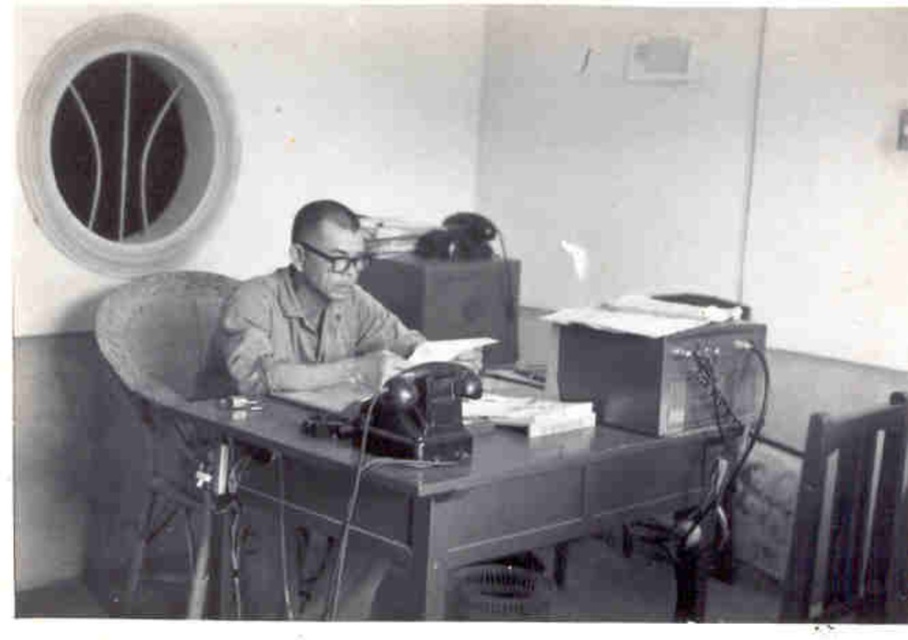
Question: Considering the real-world distances, which object is farthest from the metallic gray table at center?

Choices:
 (A) matte khaki shirt at center
 (B) metallic wireframe chair at lower right
 (C) wooden chair at left

Answer: (B)

Question: Does wooden chair at left appear on the right side of wooden chair at right?

Choices:
 (A) no
 (B) yes

Answer: (A)

Question: Is wooden chair at left positioned before matte khaki shirt at center?

Choices:
 (A) yes
 (B) no

Answer: (A)

Question: From the image, what is the correct spatial relationship of matte khaki shirt at center in relation to metallic wireframe chair at lower right?

Choices:
 (A) left
 (B) right

Answer: (A)

Question: Which of the following is the closest to the observer?

Choices:
 (A) (762, 364)
 (B) (469, 392)
 (C) (795, 572)
 (D) (203, 504)

Answer: (C)

Question: Which object is the closest to the metallic wireframe chair at lower right?

Choices:
 (A) metallic gray table at center
 (B) matte khaki shirt at center
 (C) wooden chair at right

Answer: (C)